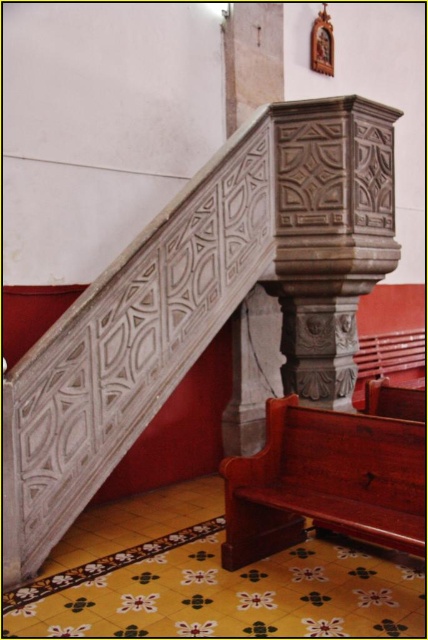
Can you confirm if white stone staircase at upper left is bigger than mahogany wood church bench at lower right?

Yes, white stone staircase at upper left is bigger than mahogany wood church bench at lower right.

Between white stone staircase at upper left and mahogany wood church bench at lower right, which one appears on the right side from the viewer's perspective?

mahogany wood church bench at lower right

Is point (21, 401) farther from camera compared to point (409, 552)?

Yes, point (21, 401) is farther from viewer.

The width and height of the screenshot is (428, 640). Identify the location of white stone staircase at upper left. (201, 304).